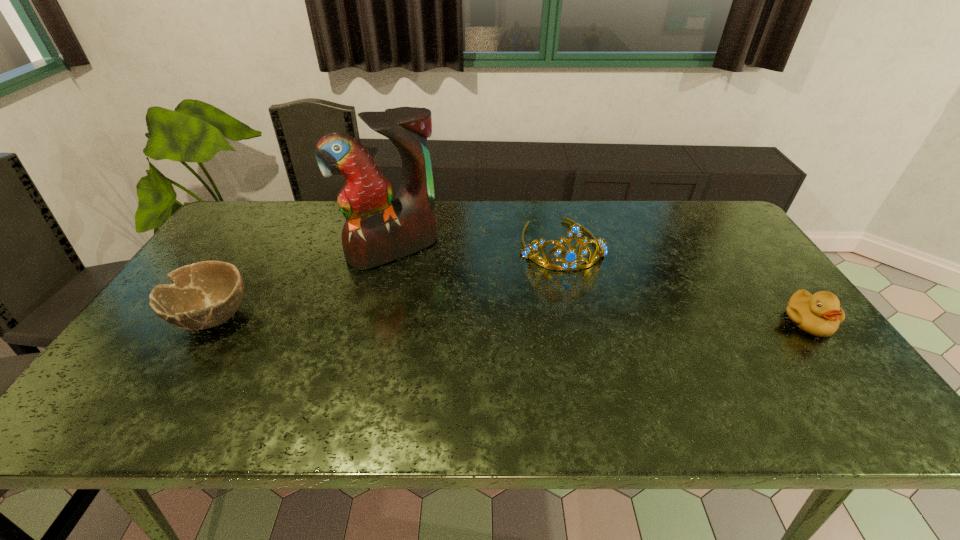
The image size is (960, 540). In order to click on blank area at the right edge in this screenshot , I will do `click(790, 327)`.

The width and height of the screenshot is (960, 540). In the image, there is a desktop. What are the coordinates of `vacant space at the near left corner` in the screenshot? It's located at (165, 370).

In order to click on vacant space at the near right corner of the desktop in this screenshot , I will do `click(805, 369)`.

At what (x,y) coordinates should I click in order to perform the action: click on vacant space that's between the second tallest object and the bowl. Please return your answer as a coordinate pair (x, y). Looking at the image, I should click on (387, 281).

What are the coordinates of `unoccupied position between the third object from left to right and the duckling` in the screenshot? It's located at (684, 283).

The width and height of the screenshot is (960, 540). In order to click on vacant space that is in between the third object from right to left and the tiara in this screenshot , I will do `click(477, 247)`.

At what (x,y) coordinates should I click in order to perform the action: click on free space between the bowl and the parrot. Please return your answer as a coordinate pair (x, y). Image resolution: width=960 pixels, height=540 pixels. Looking at the image, I should click on (302, 284).

You are a GUI agent. You are given a task and a screenshot of the screen. Output one action in this format:
    pyautogui.click(x=<x>, y=<y>)
    Task: Click on the blank region between the bowl and the rightmost object
    The image size is (960, 540).
    Given the screenshot: What is the action you would take?
    pyautogui.click(x=510, y=319)

Identify the location of unoccupied area between the rightmost object and the bowl. (510, 319).

Identify the location of empty location between the rightmost object and the leftmost object. (510, 319).